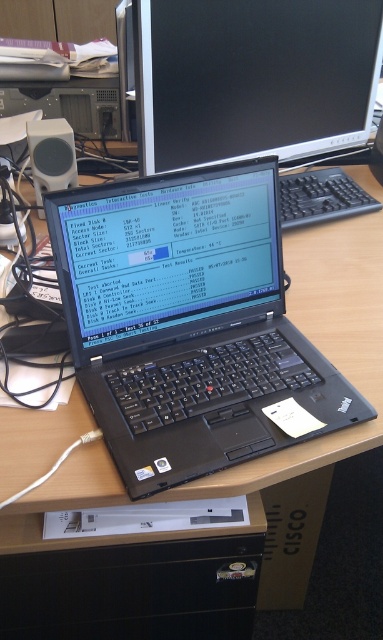
You are setting up a new workspace and want to place a decorative item on the desk. The desk has a coordinate system where the bottom left corner is the origin. The point at coordinates (186, 323) marks the location of the black matte laptop at center. If you want to place the decorative item 0.2 units to the right and 0.1 units above the laptop, what are the new coordinates for the decorative item?

The new coordinates would be calculated by adding 0.2 to the x coordinate and 0.1 to the y coordinate of the point (186, 323). Therefore, the new coordinates are 0.705, 0.588.

You are setting up a desk and need to place both the black matte laptop at center and the black plastic keyboard at center. Since you want to maximize vertical space, which object should you place higher up to ensure there is enough room below for other items?

The black matte laptop at center is much taller than the black plastic keyboard at center, so you should place the black matte laptop at center higher up to save vertical space below for other items.